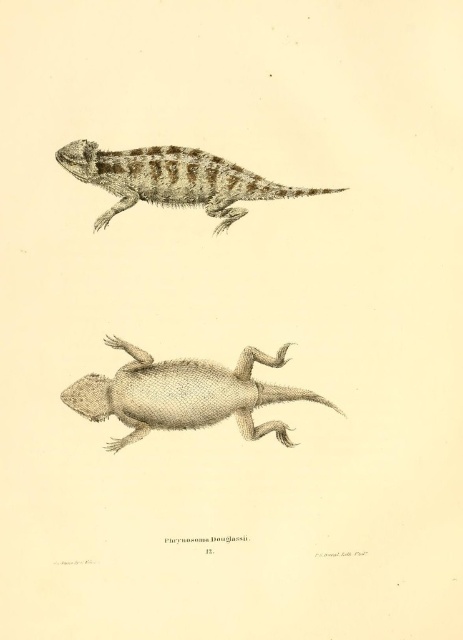
Looking at the two lizards in the image, the smooth beige lizard at center and the brown textured lizard at upper center, which one has a shorter tail?

Both lizards have short tails as described in the reptile description. The question cannot be answered based on the provided information since the tail length is not differentiated between the two.

You are an artist who wants to draw a new reptile between the smooth beige lizard at center and the brown textured lizard at upper center. The space between them is 12.81 inches. If your new reptile drawing needs to be 6 inches wide, will there be enough space?

The distance between the smooth beige lizard at center and the brown textured lizard at upper center is 12.81 inches. Since your new reptile drawing is only 6 inches wide, there is enough space to fit it between them.

You are examining the top illustration of the Phrynosoma Douglassii. You notice two points marked on the lizard. The first point is at coordinate point [162,420] and the second is at point [219,172]. Which of these two points is closer to you?

Point [162,420] is closer to the camera than point [219,172].